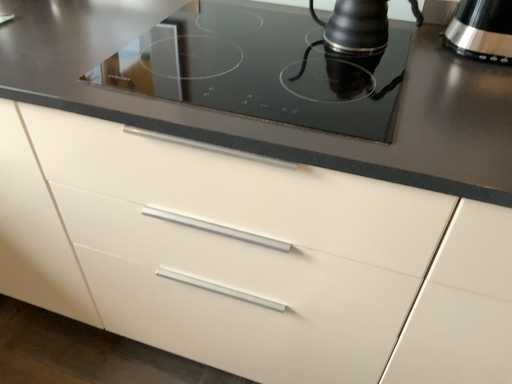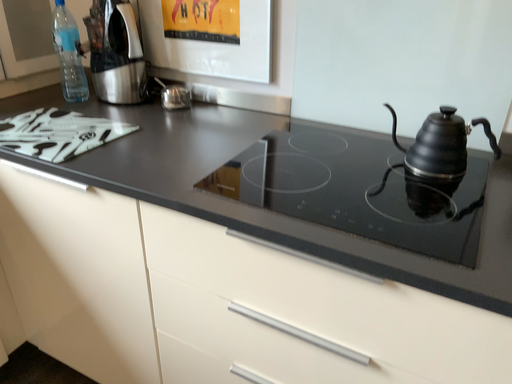
Question: How did the camera likely rotate when shooting the video?

Choices:
 (A) rotated upward
 (B) rotated downward

Answer: (A)